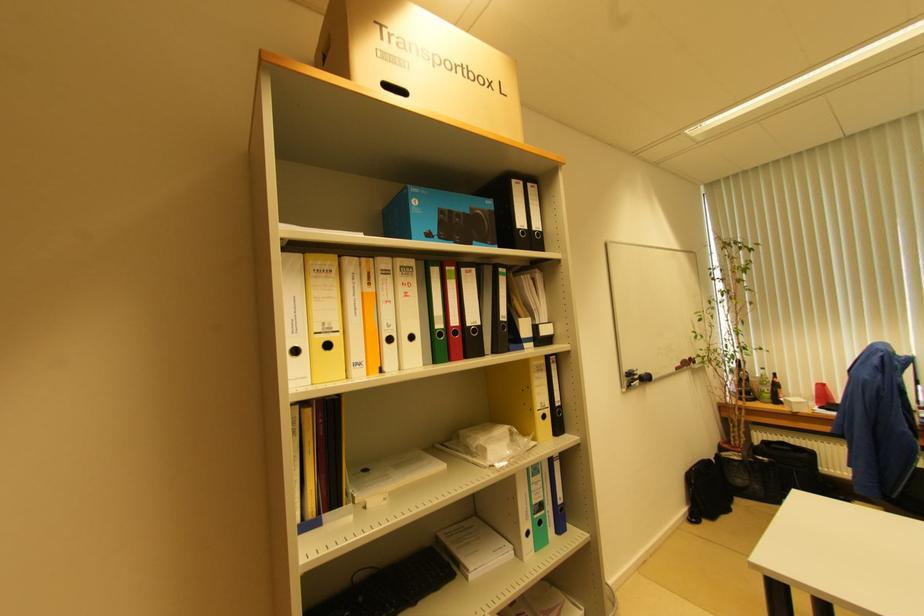
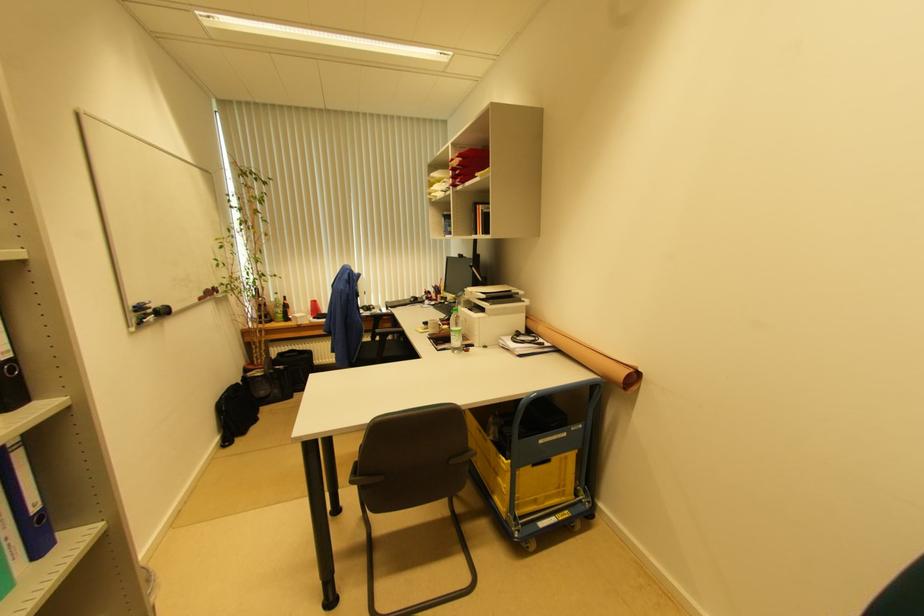
The point at [639,383] is marked in the first image. Where is the corresponding point in the second image?

(154, 318)